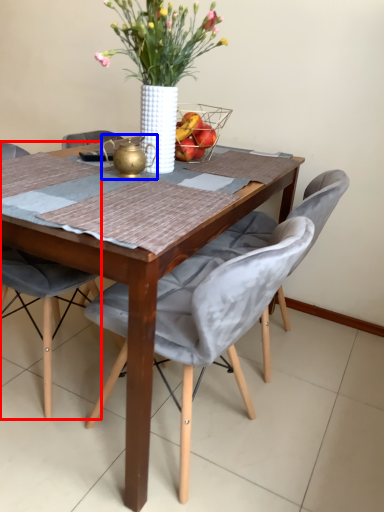
Question: Among these objects, which one is nearest to the camera, chair (highlighted by a red box) or tea pot (highlighted by a blue box)?

Choices:
 (A) chair
 (B) tea pot

Answer: (A)